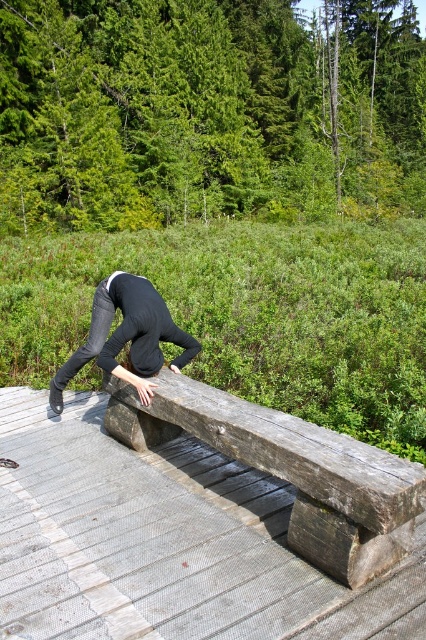
Question: Which point appears farthest from the camera in this image?

Choices:
 (A) (65, 524)
 (B) (92, 314)

Answer: (B)

Question: Is wooden bench at center below dark gray jeans at center?

Choices:
 (A) yes
 (B) no

Answer: (A)

Question: Which point appears farthest from the camera in this image?

Choices:
 (A) (132, 520)
 (B) (97, 305)

Answer: (B)

Question: Is wooden bench at center below dark gray jeans at center?

Choices:
 (A) no
 (B) yes

Answer: (B)

Question: Does wooden bench at center have a lesser width compared to dark gray jeans at center?

Choices:
 (A) no
 (B) yes

Answer: (A)